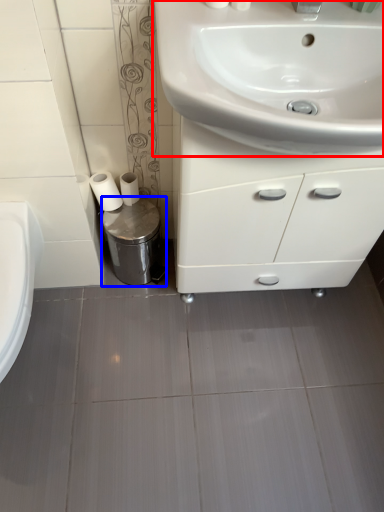
Question: Which of the following is the closest to the observer, sink (highlighted by a red box) or bidet (highlighted by a blue box)?

Choices:
 (A) sink
 (B) bidet

Answer: (A)